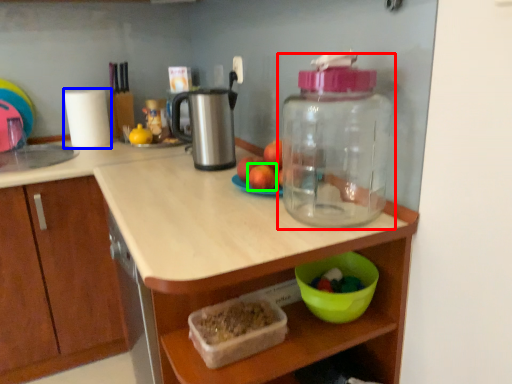
Question: Based on their relative distances, which object is farther from bottle (highlighted by a red box)? Choose from paper towel (highlighted by a blue box) and apple (highlighted by a green box).

Choices:
 (A) paper towel
 (B) apple

Answer: (A)